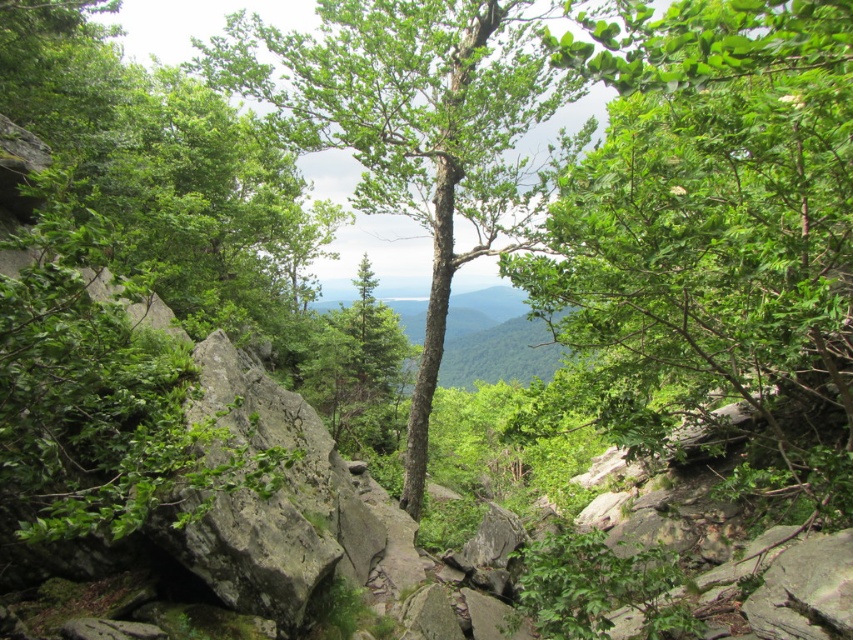
You are a hiker navigating through the forest and want to identify the smaller tree between the green leafy tree at center and the green rough bark tree at center. Which one should you look for?

The green leafy tree at center occupies less space than the green rough bark tree at center, so you should look for the green leafy tree at center as it is the smaller one.

You are a hiker trying to navigate through the forest. You see a green leafy tree at center and a green rough bark tree at center. Which tree is shorter?

The green leafy tree at center is shorter than the green rough bark tree at center according to the description.

You are a hiker navigating through the forest and need to determine the shortest path between two points. You see a point at coordinate (712, 22) and another at (252, 90). Which point is closer to you, the hiker, as you stand at the starting point?

Point (712, 22) is closer to the viewer than point (252, 90), so the point at coordinate (712, 22) is closer to you as the hiker.